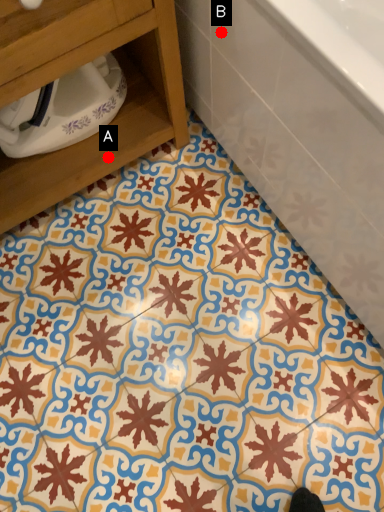
Question: Two points are circled on the image, labeled by A and B beside each circle. Which point appears farthest from the camera in this image?

Choices:
 (A) A is further
 (B) B is further

Answer: (A)